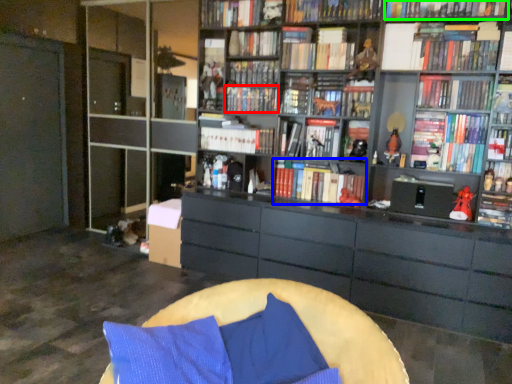
Question: Which object is positioned farthest from book (highlighted by a red box)? Select from book (highlighted by a blue box) and book (highlighted by a green box).

Choices:
 (A) book
 (B) book

Answer: (B)